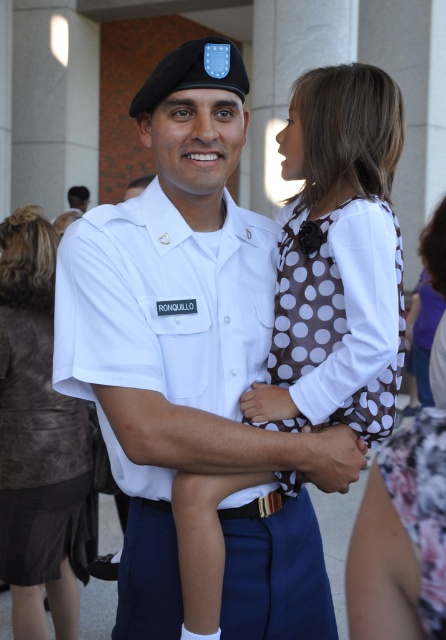
Question: Can you confirm if brown dotted dress at center is positioned below brown suede jacket at upper left?

Choices:
 (A) yes
 (B) no

Answer: (B)

Question: Is white uniform at center smaller than brown suede jacket at upper left?

Choices:
 (A) no
 (B) yes

Answer: (A)

Question: Estimate the real-world distances between objects in this image. Which object is farther from the brown suede jacket at upper left?

Choices:
 (A) brown dotted fabric at upper center
 (B) white uniform at center

Answer: (A)

Question: Among these objects, which one is nearest to the camera?

Choices:
 (A) brown suede jacket at upper left
 (B) brown dotted dress at center
 (C) brown dotted fabric at upper center

Answer: (C)

Question: Which of the following is the farthest from the observer?

Choices:
 (A) brown dotted fabric at upper center
 (B) white uniform at center
 (C) brown suede jacket at upper left
 (D) brown dotted dress at center

Answer: (C)

Question: Is the position of white uniform at center less distant than that of brown dotted fabric at upper center?

Choices:
 (A) no
 (B) yes

Answer: (A)